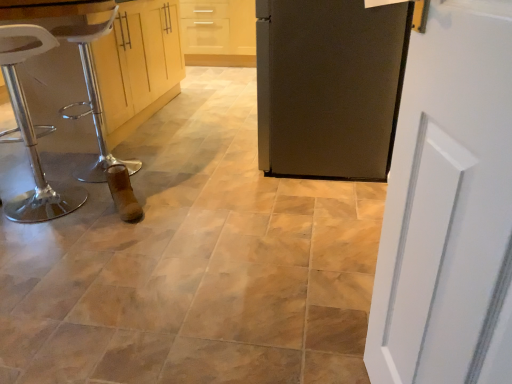
At what (x,y) coordinates should I click in order to perform the action: click on free space to the left of matte black refrigerator at center, which ranks as the 2th door in bottom-to-top order. Please return your answer as a coordinate pair (x, y). The image size is (512, 384). Looking at the image, I should click on (203, 159).